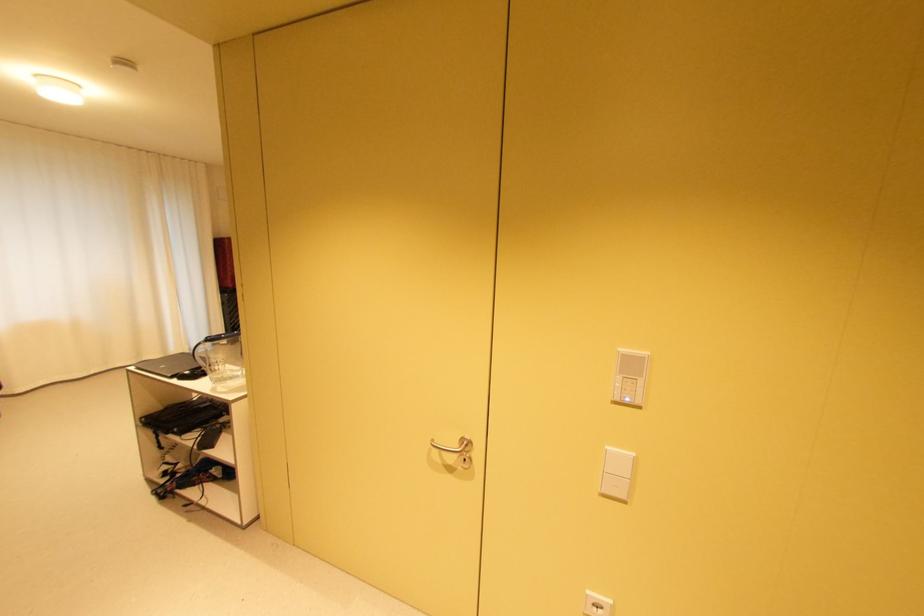
Where would you lift the closed black laptop? Please return your answer as a coordinate pair (x, y).

(167, 363)